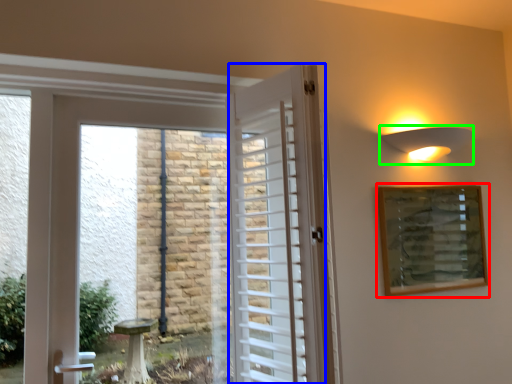
Question: Which object is positioned farthest from picture frame (highlighted by a red box)? Select from door (highlighted by a blue box) and light fixture (highlighted by a green box).

Choices:
 (A) door
 (B) light fixture

Answer: (A)